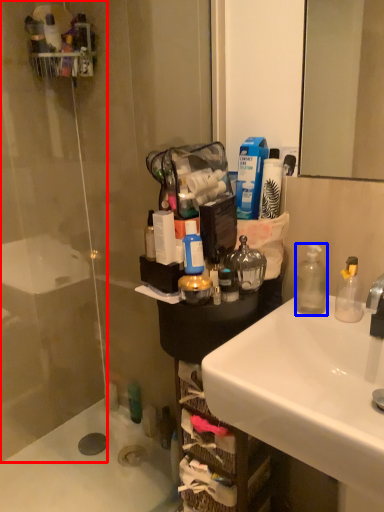
Question: Which object is closer to the camera taking this photo, glass door (highlighted by a red box) or bottle (highlighted by a blue box)?

Choices:
 (A) glass door
 (B) bottle

Answer: (B)